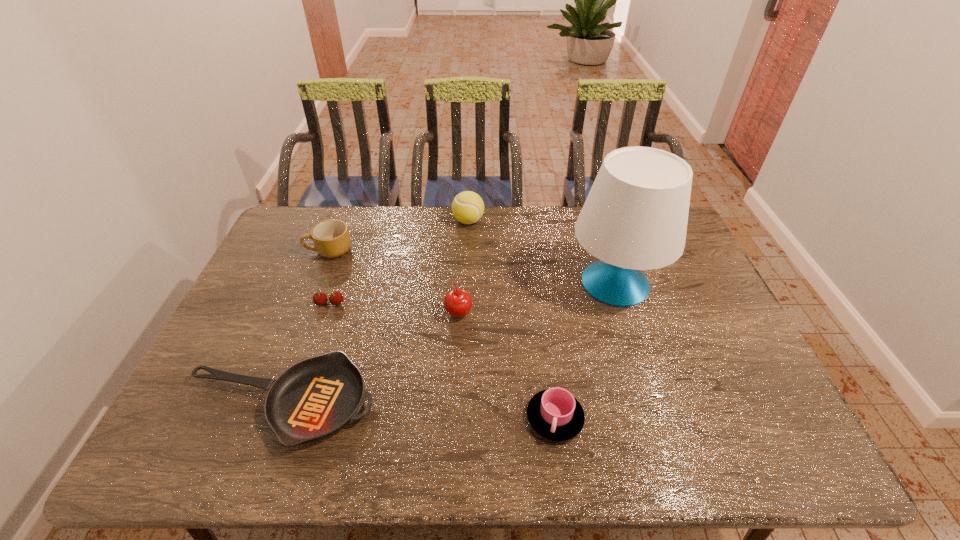
Where is `cup at the near edge`? Image resolution: width=960 pixels, height=540 pixels. cup at the near edge is located at coordinates (555, 414).

Identify the location of frying pan that is at the near edge. (316, 397).

Locate an element on the screen. mug at the left edge is located at coordinates (331, 238).

The width and height of the screenshot is (960, 540). I want to click on frying pan that is positioned at the left edge, so (x=316, y=397).

Identify the location of object located at the right edge. (635, 217).

The image size is (960, 540). What are the coordinates of `object that is at the far left corner` in the screenshot? It's located at (331, 238).

You are a GUI agent. You are given a task and a screenshot of the screen. Output one action in this format:
    pyautogui.click(x=<x>, y=<y>)
    Task: Click on the object that is at the near left corner
    
    Given the screenshot: What is the action you would take?
    pyautogui.click(x=316, y=397)

Find the location of a particular element. This screenshot has height=540, width=960. free spot at the far edge of the desktop is located at coordinates (412, 214).

Where is `vacant space at the near edge`? The height and width of the screenshot is (540, 960). vacant space at the near edge is located at coordinates (627, 442).

Locate an element on the screen. The height and width of the screenshot is (540, 960). vacant space at the left edge of the desktop is located at coordinates pos(287,256).